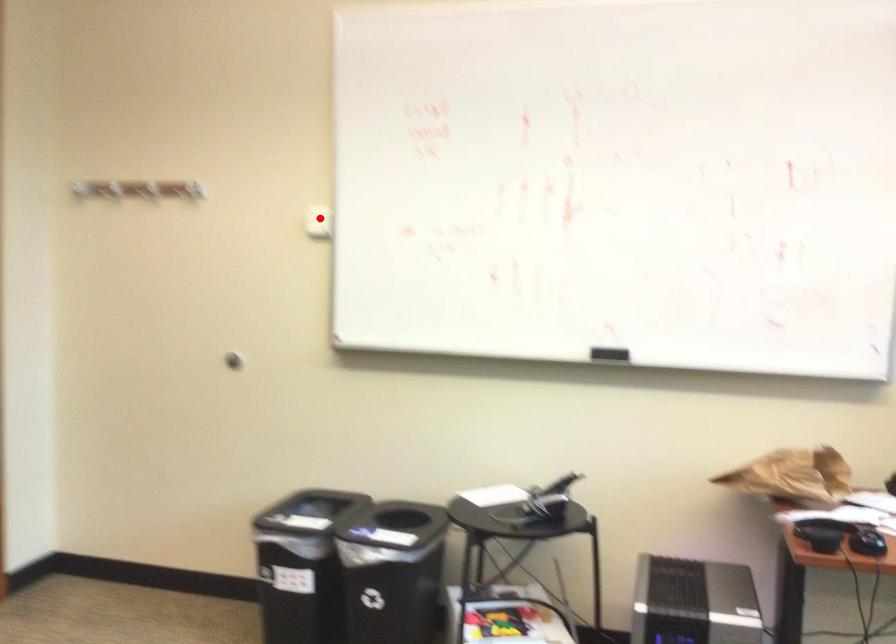
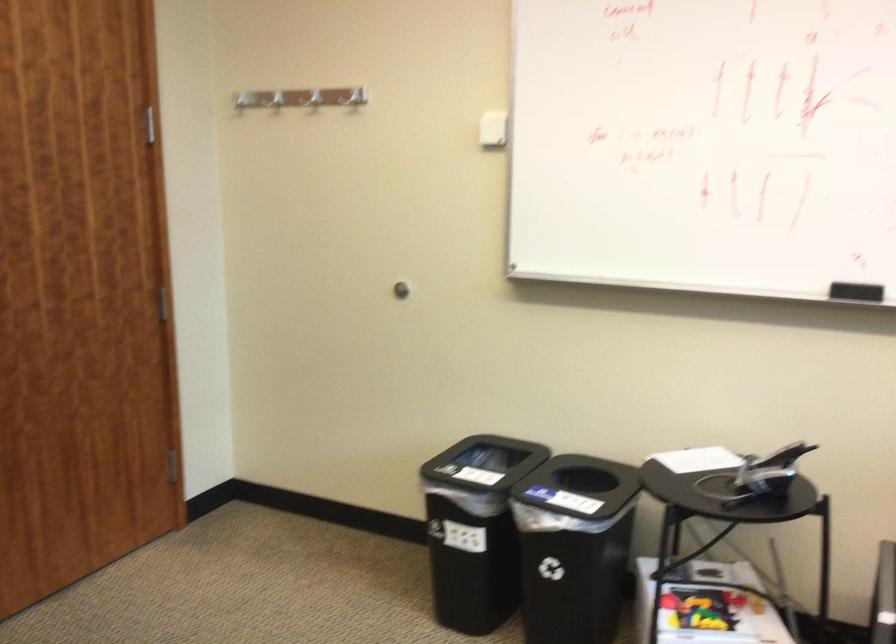
Locate, in the second image, the point that corresponds to the highlighted location in the first image.

(493, 129)